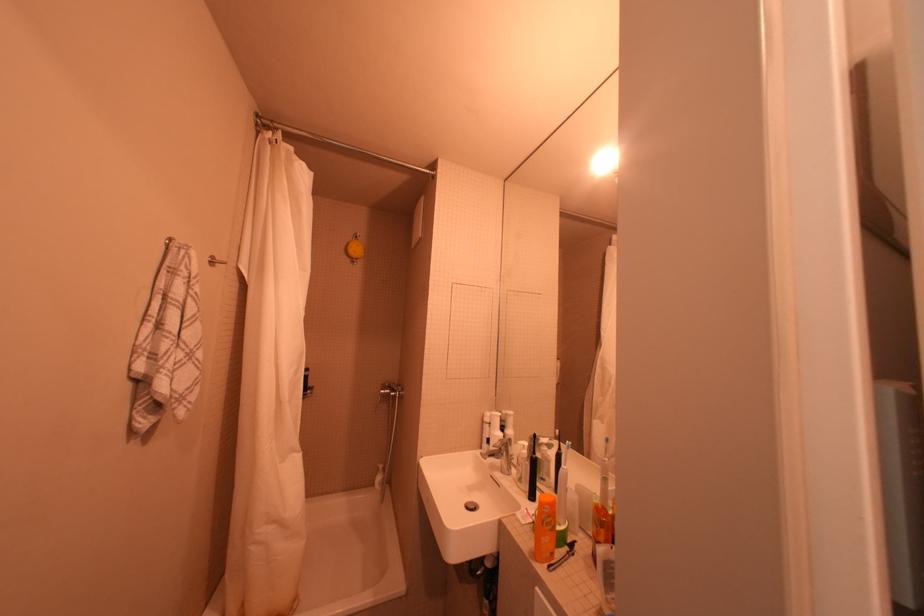
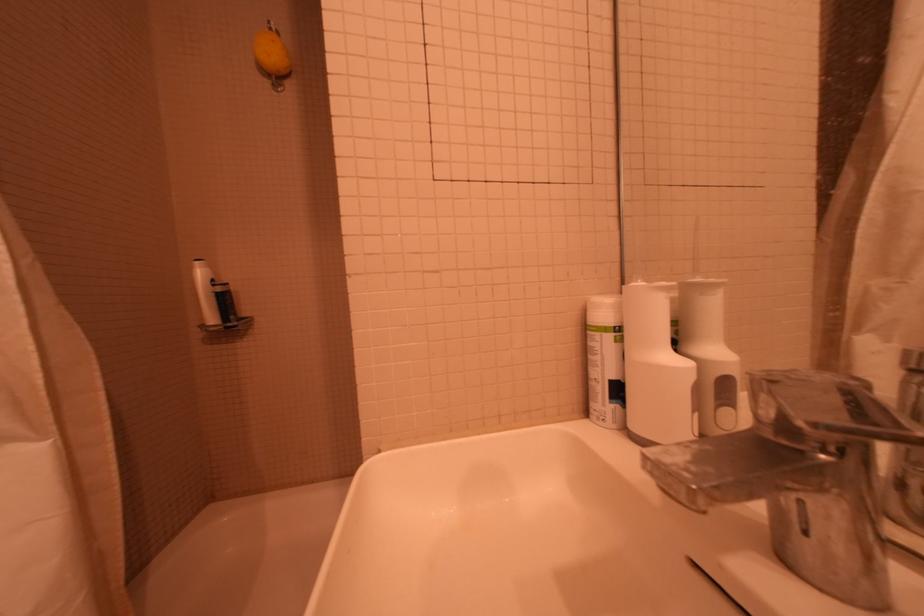
In the second image, find the point that corresponds to the point at 492,422 in the first image.

(593, 330)